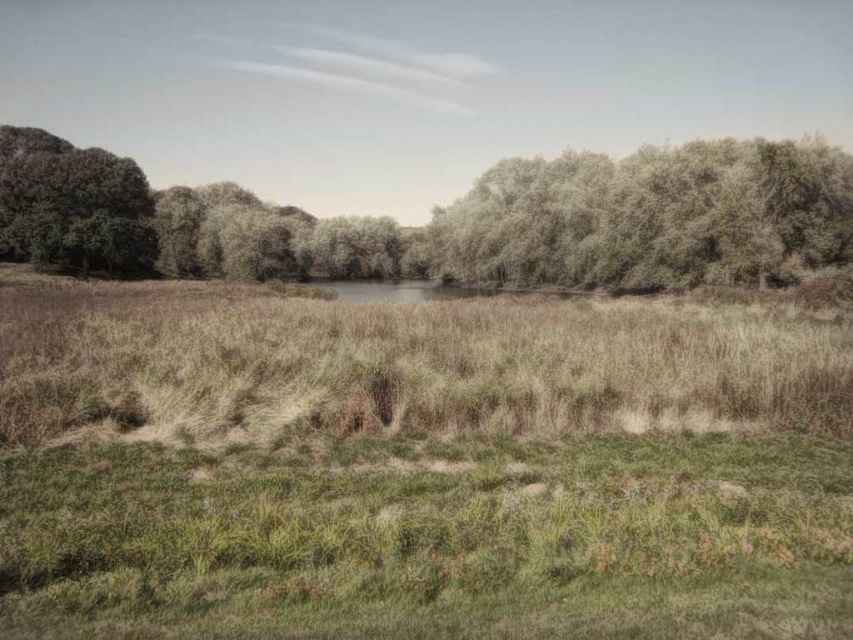
Question: Can you confirm if green grassy field at center is bigger than green leafy trees at upper center?

Choices:
 (A) yes
 (B) no

Answer: (B)

Question: Which object is positioned closest to the green leafy trees at upper center?

Choices:
 (A) green grassy field at center
 (B) green leafy tree at upper left

Answer: (B)

Question: Which point is farther to the camera?

Choices:
 (A) green leafy tree at upper left
 (B) green leafy trees at upper center
 (C) green grassy field at center

Answer: (A)

Question: Among these points, which one is farthest from the camera?

Choices:
 (A) (76, 552)
 (B) (15, 221)
 (C) (70, 259)

Answer: (C)

Question: Can you confirm if green grassy field at center is wider than green leafy tree at upper left?

Choices:
 (A) no
 (B) yes

Answer: (B)

Question: Can you confirm if green grassy field at center is positioned below green leafy trees at upper center?

Choices:
 (A) yes
 (B) no

Answer: (A)